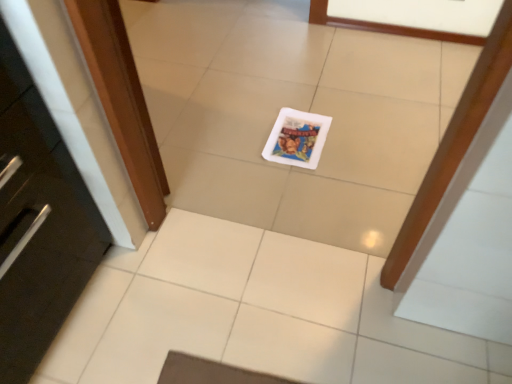
Where is `vacant space to the right of white matte postcard at center`? vacant space to the right of white matte postcard at center is located at coordinates (367, 144).